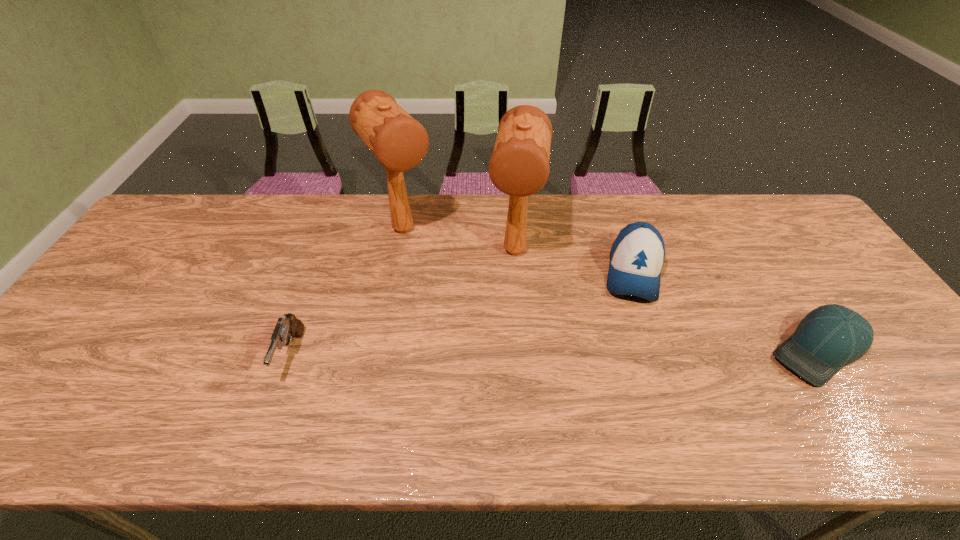
Locate an element on the screen. The width and height of the screenshot is (960, 540). the fourth tallest object is located at coordinates (289, 326).

What are the coordinates of `pistol` in the screenshot? It's located at (289, 326).

Find the location of a particular element. The image size is (960, 540). the shorter baseball cap is located at coordinates (828, 338).

Locate an element on the screen. The width and height of the screenshot is (960, 540). the rightmost object is located at coordinates (828, 338).

This screenshot has width=960, height=540. Find the location of `the farther baseball cap`. the farther baseball cap is located at coordinates (637, 255).

Find the location of a particular element. This screenshot has width=960, height=540. the taller baseball cap is located at coordinates (637, 255).

I want to click on the left mallet, so click(x=399, y=142).

The height and width of the screenshot is (540, 960). In order to click on the third object from right to left in this screenshot , I will do `click(519, 166)`.

Identify the location of vacant space located 0.380m on the back of the shorter baseball cap. The width and height of the screenshot is (960, 540). (738, 225).

The height and width of the screenshot is (540, 960). What are the coordinates of `free space located on the front-facing side of the taller baseball cap` in the screenshot? It's located at (633, 339).